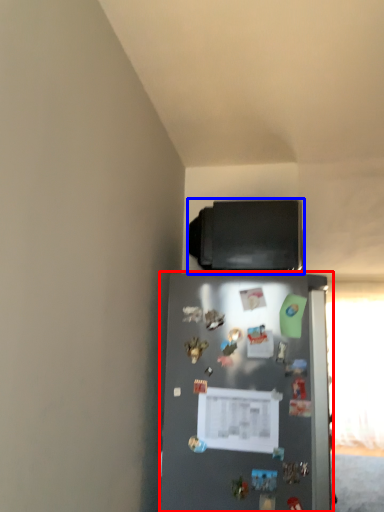
Question: Which object is further to the camera taking this photo, refrigerator (highlighted by a red box) or appliance (highlighted by a blue box)?

Choices:
 (A) refrigerator
 (B) appliance

Answer: (B)